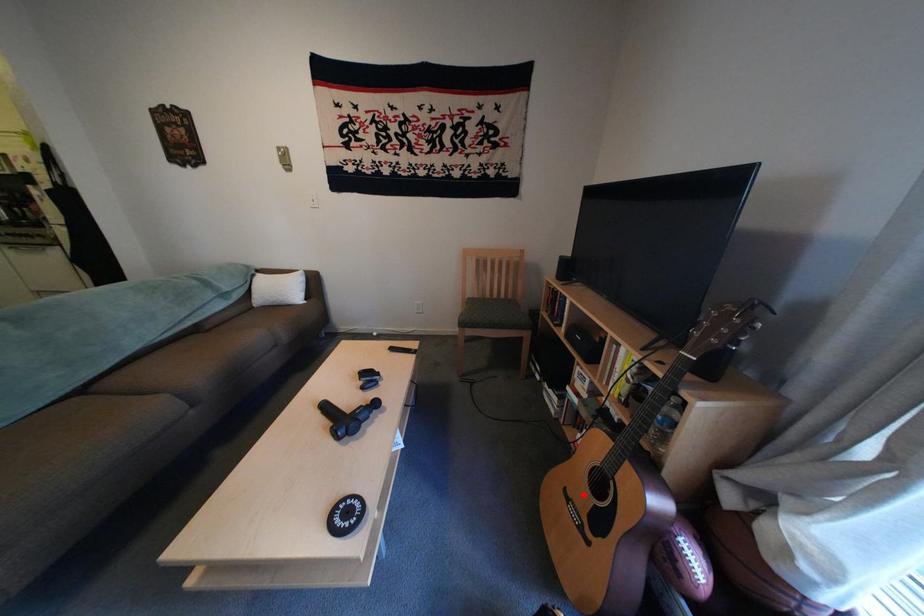
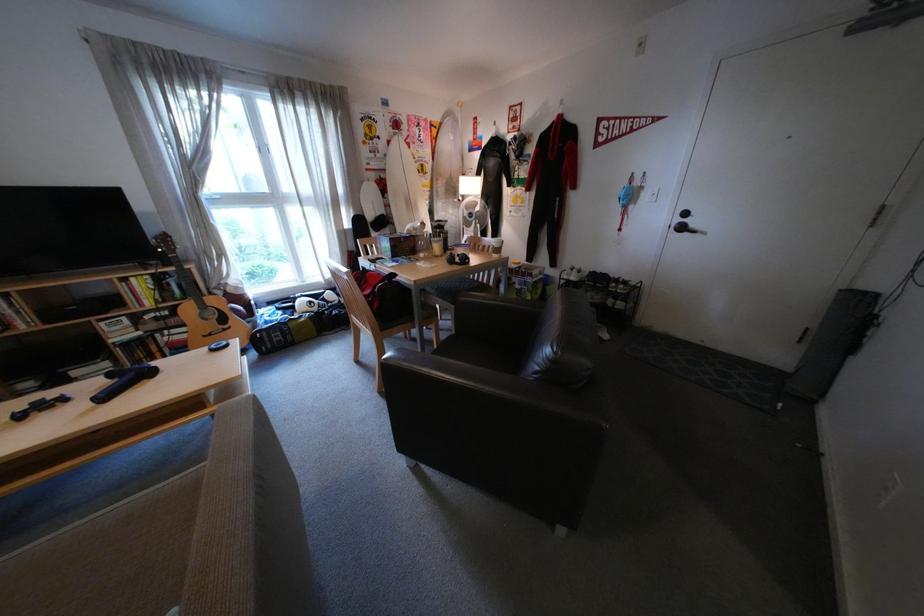
Where in the second image is the point corresponding to the highlighted location from the first image?

(220, 334)